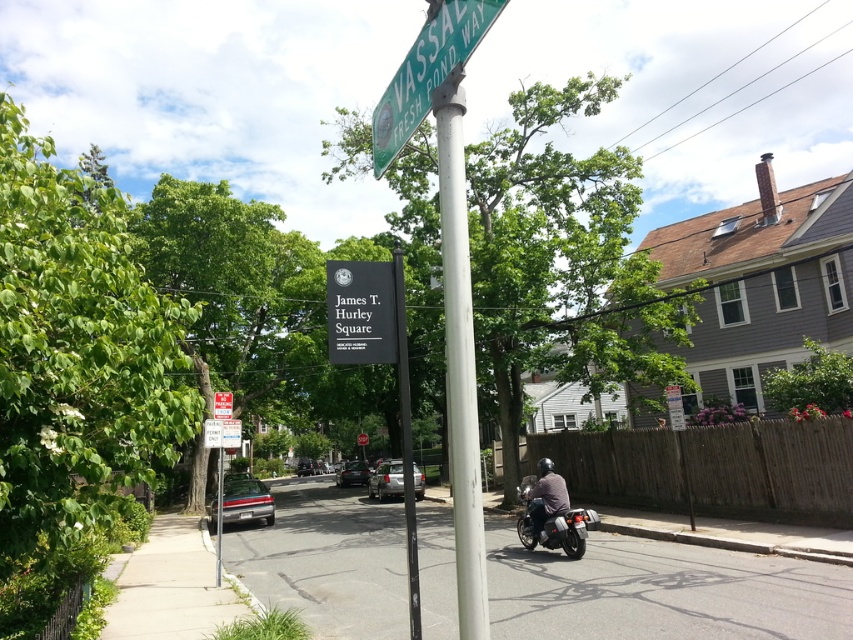
Question: Does green plastic street sign at upper center appear over shiny black motorcycle at center?

Choices:
 (A) yes
 (B) no

Answer: (A)

Question: Among these points, which one is nearest to the camera?

Choices:
 (A) (215, 572)
 (B) (633, 614)

Answer: (B)

Question: Which of the following is the closest to the observer?

Choices:
 (A) (585, 522)
 (B) (456, 42)
 (C) (450, 211)

Answer: (B)

Question: Does green plastic street sign at upper center appear over metallic pole at center?

Choices:
 (A) no
 (B) yes

Answer: (B)

Question: Is white metallic pole at center wider than shiny black motorcycle at center?

Choices:
 (A) no
 (B) yes

Answer: (A)

Question: Which point appears farthest from the camera in this image?

Choices:
 (A) (271, 582)
 (B) (466, 234)

Answer: (A)